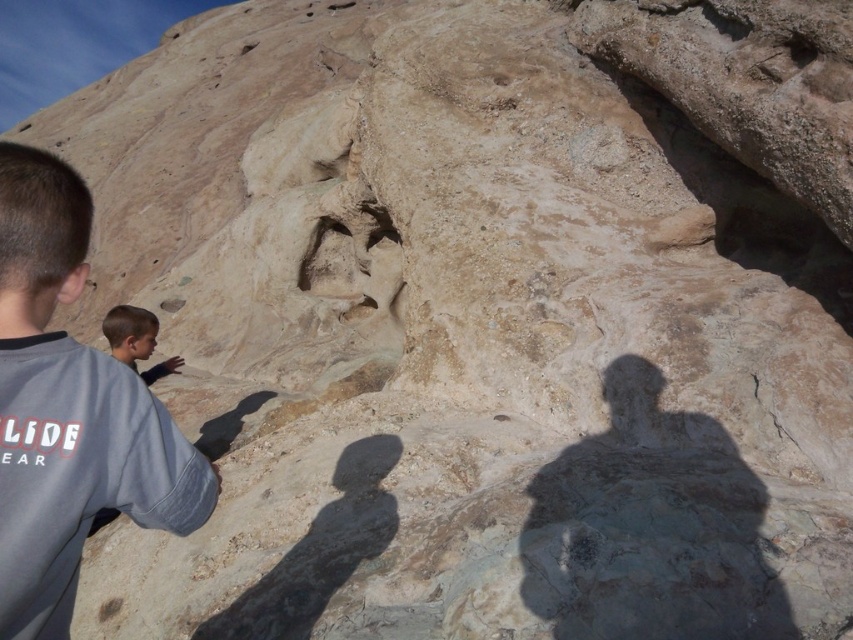
Question: Is light brown hair at lower left above smooth skin face at lower left?

Choices:
 (A) yes
 (B) no

Answer: (B)

Question: Is gray cotton shirt at upper left above light brown hair at lower left?

Choices:
 (A) yes
 (B) no

Answer: (A)

Question: Which object appears farthest from the camera in this image?

Choices:
 (A) smooth skin face at lower left
 (B) gray cotton shirt at upper left
 (C) light brown hair at lower left

Answer: (C)

Question: Based on their relative distances, which object is farther from the light brown hair at lower left?

Choices:
 (A) smooth skin face at lower left
 (B) gray cotton shirt at upper left

Answer: (B)

Question: Can you confirm if light brown hair at lower left is positioned above smooth skin face at lower left?

Choices:
 (A) no
 (B) yes

Answer: (A)

Question: Among these points, which one is farthest from the camera?

Choices:
 (A) (132, 348)
 (B) (126, 337)
 (C) (1, 452)

Answer: (A)